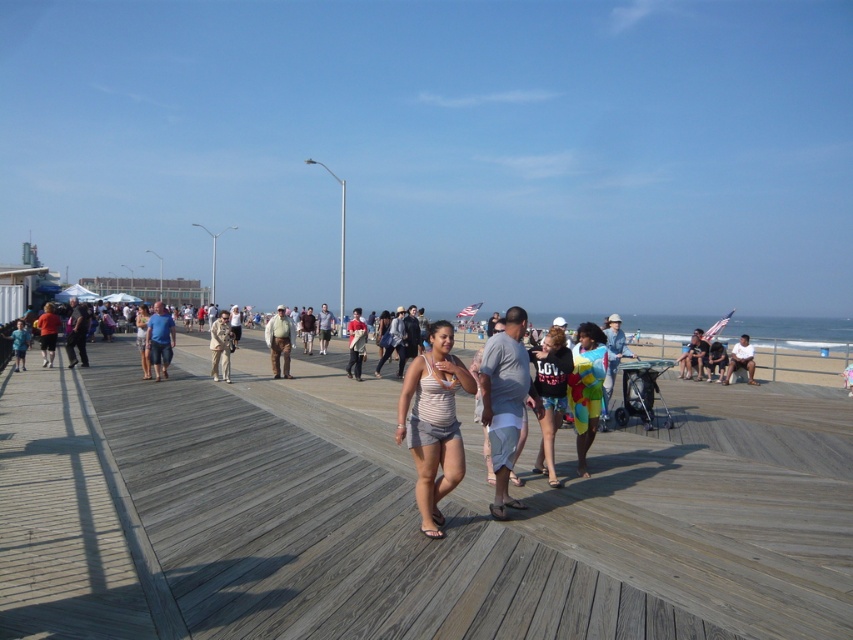
You are a photographer standing on the boardwalk and want to take a photo of both the blue denim shorts at center and the denim jacket at center. Which object should you position to the left side of your photo frame to include both in the shot?

To include both the blue denim shorts at center and the denim jacket at center in the photo frame, position the blue denim shorts at center on the left side since it is already to the left of the denim jacket at center.

In the scene shown: You are a photographer standing on the boardwalk and notice both the blue denim shorts at center and the light brown leather jacket at center. Which item is closer to the ground?

The blue denim shorts at center is positioned under the light brown leather jacket at center, so it is closer to the ground.

Consider the image. You are a photographer standing on the boardwalk and want to capture both the gray cotton shirt at center and the multicolored beach towel at right in the same frame. Which object should you focus on first to ensure both are in the shot?

You should focus on the multicolored beach towel at right first because the gray cotton shirt at center is narrower than it, so centering the wider object will help include both in the frame.